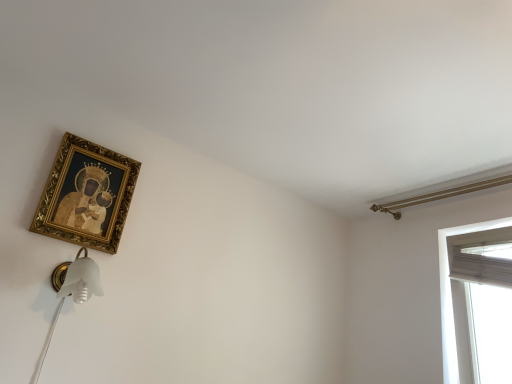
Question: Are gold ornate frame at upper left and white sheer curtain at right beside each other?

Choices:
 (A) no
 (B) yes

Answer: (A)

Question: Does gold ornate frame at upper left have a smaller size compared to white sheer curtain at right?

Choices:
 (A) yes
 (B) no

Answer: (A)

Question: Does gold ornate frame at upper left turn towards white sheer curtain at right?

Choices:
 (A) yes
 (B) no

Answer: (B)

Question: Does gold ornate frame at upper left have a larger size compared to white sheer curtain at right?

Choices:
 (A) no
 (B) yes

Answer: (A)

Question: From the image's perspective, is gold ornate frame at upper left on top of white sheer curtain at right?

Choices:
 (A) yes
 (B) no

Answer: (A)

Question: Can you confirm if gold ornate frame at upper left is positioned to the right of white sheer curtain at right?

Choices:
 (A) yes
 (B) no

Answer: (B)

Question: Is white sheer curtain at right looking in the opposite direction of gold ornate frame at upper left?

Choices:
 (A) no
 (B) yes

Answer: (A)

Question: From a real-world perspective, is white sheer curtain at right positioned over gold ornate frame at upper left based on gravity?

Choices:
 (A) no
 (B) yes

Answer: (A)

Question: From the image's perspective, is white sheer curtain at right located beneath gold ornate frame at upper left?

Choices:
 (A) yes
 (B) no

Answer: (A)

Question: Is white sheer curtain at right surrounding gold ornate frame at upper left?

Choices:
 (A) yes
 (B) no

Answer: (B)

Question: Is white sheer curtain at right aimed at gold ornate frame at upper left?

Choices:
 (A) no
 (B) yes

Answer: (A)

Question: Is white sheer curtain at right at the right side of gold ornate frame at upper left?

Choices:
 (A) no
 (B) yes

Answer: (B)

Question: In terms of size, does white sheer curtain at right appear bigger or smaller than gold ornate frame at upper left?

Choices:
 (A) big
 (B) small

Answer: (A)